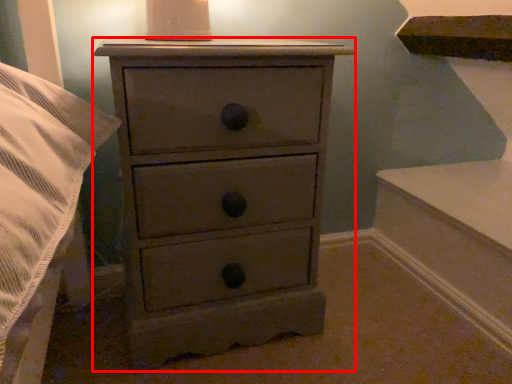
Question: In this image, where is chest of drawers (annotated by the red box) located relative to candle holder?

Choices:
 (A) right
 (B) left

Answer: (A)